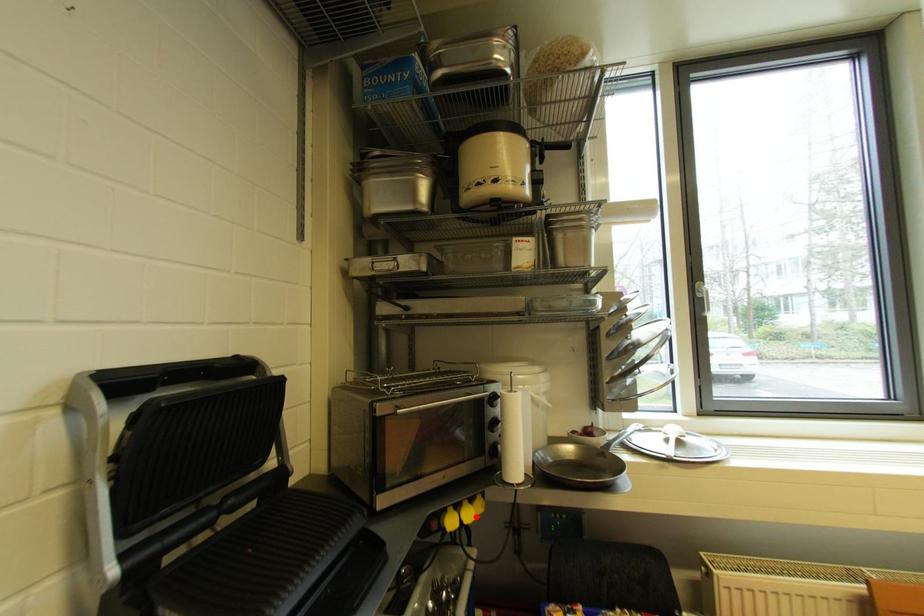
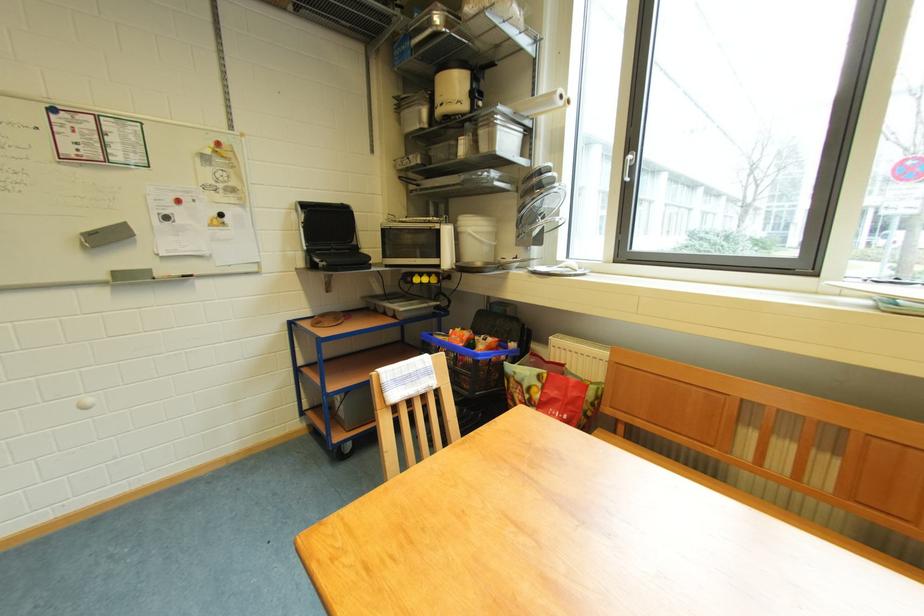
Find the pixel in the second image that matches the highlighted location in the first image.

(432, 283)